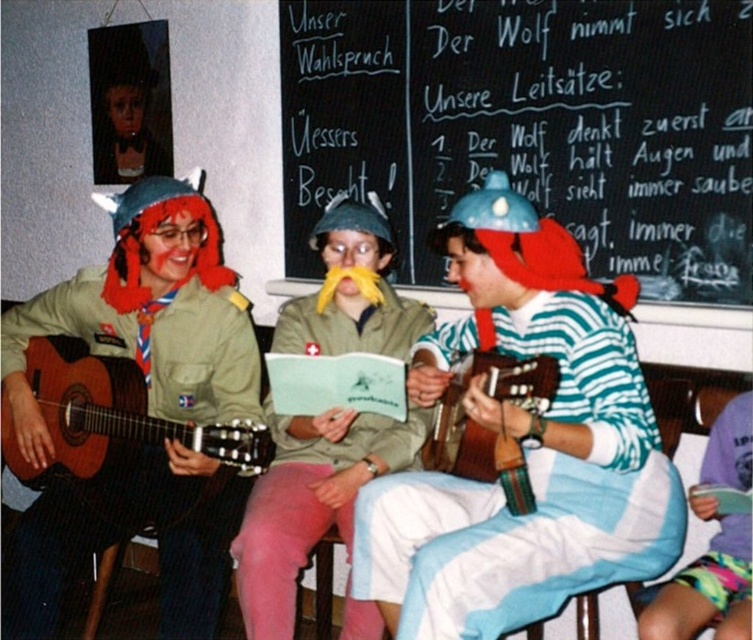
You are organizing a costume party and need to arrange the striped cotton shirt at center and the green uniform at left on a narrow shelf. Which item should you place first to ensure both fit side by side?

The striped cotton shirt at center has a lesser width compared to green uniform at left, so place the striped cotton shirt at center first to accommodate the wider green uniform at left next to it.

You are an attendee in the classroom and want to write a note on the black chalkboard at upper center. Where should you look to find it?

The black chalkboard at upper center is located at point 0.198 on the horizontal axis and 0.707 on the vertical axis.